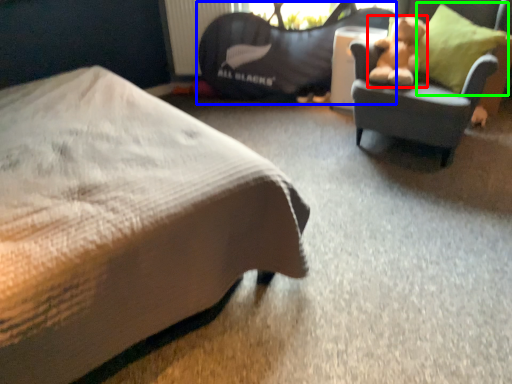
Question: Considering the real-world distances, which object is closest to teddy bear (highlighted by a red box)? bean bag chair (highlighted by a blue box) or throw pillow (highlighted by a green box).

Choices:
 (A) bean bag chair
 (B) throw pillow

Answer: (B)